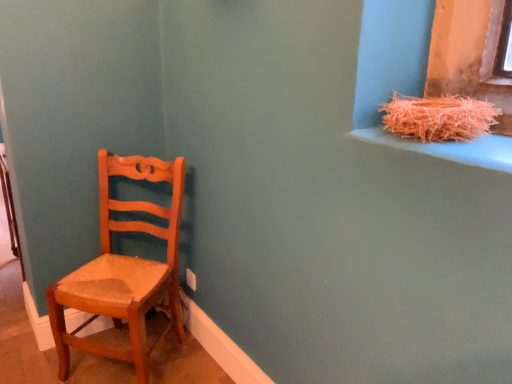
Question: Would you say orange shredded straw at upper right is to the left or to the right of wooden chair at left in the picture?

Choices:
 (A) right
 (B) left

Answer: (A)

Question: Is orange shredded straw at upper right bigger or smaller than wooden chair at left?

Choices:
 (A) small
 (B) big

Answer: (A)

Question: Would you say orange shredded straw at upper right is inside or outside wooden chair at left?

Choices:
 (A) outside
 (B) inside

Answer: (A)

Question: In terms of width, does wooden chair at left look wider or thinner when compared to orange shredded straw at upper right?

Choices:
 (A) wide
 (B) thin

Answer: (A)

Question: Is wooden chair at left situated inside orange shredded straw at upper right or outside?

Choices:
 (A) outside
 (B) inside

Answer: (A)

Question: Is wooden chair at left to the left or to the right of orange shredded straw at upper right in the image?

Choices:
 (A) right
 (B) left

Answer: (B)

Question: From a real-world perspective, is wooden chair at left positioned above or below orange shredded straw at upper right?

Choices:
 (A) above
 (B) below

Answer: (B)